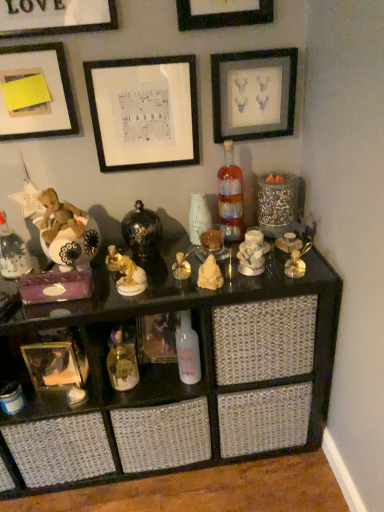
Question: Would you say black matte picture frame at upper center, placed as the 6th picture frame when sorted from bottom to top, is a long distance from gold metallic picture frame at lower left, the 1th picture frame ordered from the bottom?

Choices:
 (A) yes
 (B) no

Answer: (A)

Question: Is black matte picture frame at upper center, the first picture frame viewed from the top, further to camera compared to gold metallic picture frame at lower left, marked as the 6th picture frame in a top-to-bottom arrangement?

Choices:
 (A) no
 (B) yes

Answer: (A)

Question: Is black matte picture frame at upper center, placed as the 6th picture frame when sorted from bottom to top, located outside gold metallic picture frame at lower left, the 1th picture frame ordered from the bottom?

Choices:
 (A) yes
 (B) no

Answer: (A)

Question: Considering the relative sizes of black matte picture frame at upper center, the first picture frame viewed from the top, and gold metallic picture frame at lower left, the 1th picture frame ordered from the bottom, in the image provided, is black matte picture frame at upper center, the first picture frame viewed from the top, thinner than gold metallic picture frame at lower left, the 1th picture frame ordered from the bottom,?

Choices:
 (A) no
 (B) yes

Answer: (B)

Question: Can you confirm if black matte picture frame at upper center, placed as the 6th picture frame when sorted from bottom to top, is smaller than gold metallic picture frame at lower left, marked as the 6th picture frame in a top-to-bottom arrangement?

Choices:
 (A) yes
 (B) no

Answer: (A)

Question: From a real-world perspective, is black matte picture frame at upper center, placed as the 6th picture frame when sorted from bottom to top, physically above gold metallic picture frame at lower left, the 1th picture frame ordered from the bottom?

Choices:
 (A) no
 (B) yes

Answer: (B)

Question: From a real-world perspective, is gold metallic toy at lower center, the fifth toy positioned from the right, located higher than porcelain figurine at center, the 1th toy when ordered from right to left?

Choices:
 (A) yes
 (B) no

Answer: (B)

Question: From a real-world perspective, is gold metallic toy at lower center, the 1th toy from the left, physically below porcelain figurine at center, the 1th toy when ordered from right to left?

Choices:
 (A) no
 (B) yes

Answer: (B)

Question: Is gold metallic toy at lower center, the 1th toy from the left, taller than porcelain figurine at center, which is the 5th toy in left-to-right order?

Choices:
 (A) no
 (B) yes

Answer: (B)

Question: From the image's perspective, is gold metallic toy at lower center, the 1th toy from the left, on top of porcelain figurine at center, the 1th toy when ordered from right to left?

Choices:
 (A) yes
 (B) no

Answer: (B)

Question: Is gold metallic toy at lower center, the fifth toy positioned from the right, not inside porcelain figurine at center, the 1th toy when ordered from right to left?

Choices:
 (A) no
 (B) yes

Answer: (B)

Question: Is gold metallic toy at lower center, the fifth toy positioned from the right, not near porcelain figurine at center, the 1th toy when ordered from right to left?

Choices:
 (A) yes
 (B) no

Answer: (B)

Question: From a real-world perspective, is gold metallic perfume bottle at center, which ranks as the third toy in right-to-left order, located beneath black matte picture frame at upper center, the first picture frame viewed from the top?

Choices:
 (A) yes
 (B) no

Answer: (A)